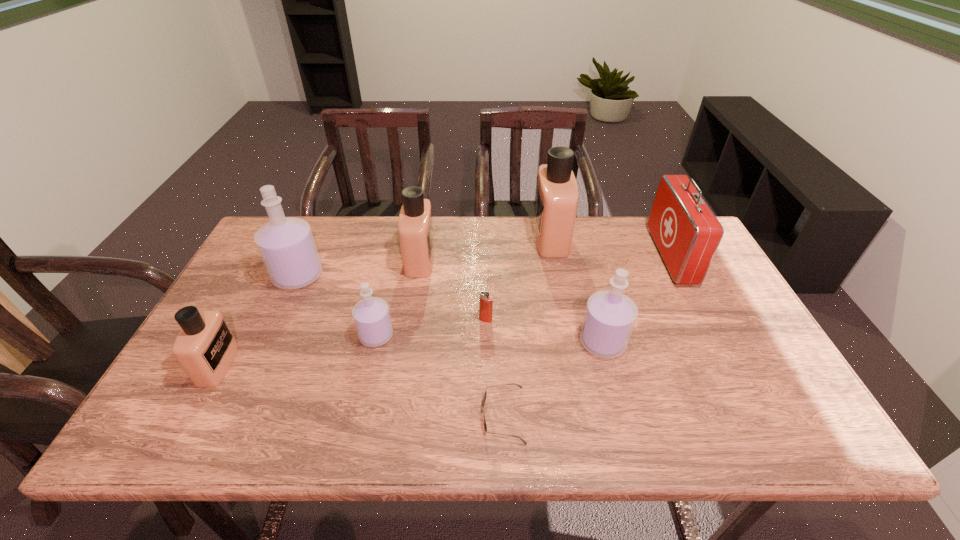
I want to click on free point between the fifth nearest object and the rightmost object, so click(578, 288).

At what (x,y) coordinates should I click in order to perform the action: click on unoccupied area between the farthest purple perfume and the second biggest beige perfume. Please return your answer as a coordinate pair (x, y). Looking at the image, I should click on (359, 268).

Image resolution: width=960 pixels, height=540 pixels. In order to click on empty space that is in between the nearest beige perfume and the smallest purple perfume in this screenshot , I will do pos(298,350).

This screenshot has width=960, height=540. What are the coordinates of `vacant point located between the eighth tallest object and the second purple perfume from left to right` in the screenshot? It's located at (431, 328).

The width and height of the screenshot is (960, 540). I want to click on free space between the igniter and the black sunglasses, so click(494, 368).

Find the location of a particular element. free space between the leftmost purple perfume and the second purple perfume from right to left is located at coordinates (337, 306).

You are a GUI agent. You are given a task and a screenshot of the screen. Output one action in this format:
    pyautogui.click(x=<x>, y=<y>)
    Task: Click on the vacant region between the eighth tallest object and the sunglasses
    The height and width of the screenshot is (540, 960).
    Given the screenshot: What is the action you would take?
    pyautogui.click(x=494, y=368)

The image size is (960, 540). In order to click on free space between the farthest purple perfume and the second biggest purple perfume in this screenshot , I will do `click(450, 309)`.

Locate an element on the screen. Image resolution: width=960 pixels, height=540 pixels. free area in between the biggest beige perfume and the smallest purple perfume is located at coordinates (464, 286).

Find the location of `object that stands as the second closest to the biggest purple perfume`. object that stands as the second closest to the biggest purple perfume is located at coordinates (371, 315).